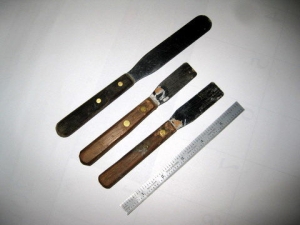
Find the location of a particular element. This screenshot has height=225, width=300. wooden handle is located at coordinates (105, 140).